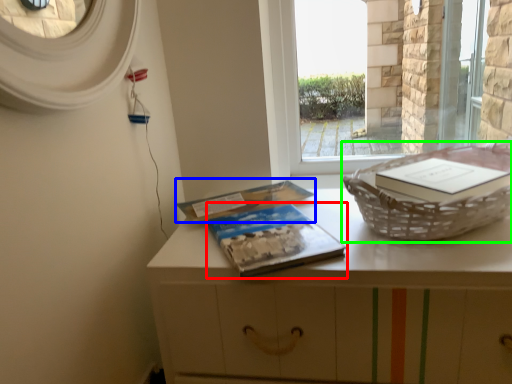
Question: Which object is the closest to the paperback book (highlighted by a red box)? Choose among these: paperback book (highlighted by a blue box) or basket container (highlighted by a green box).

Choices:
 (A) paperback book
 (B) basket container

Answer: (A)